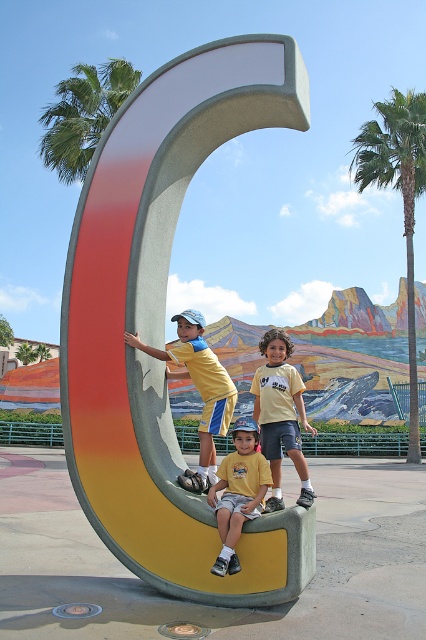
You are a photographer trying to capture a photo of the yellow matte shirt at center and the matte concrete letter c at center. Based on their positions, which object should you focus on first to ensure both are in frame?

The matte concrete letter c at center is above the yellow matte shirt at center, so you should focus on the matte concrete letter c at center first to ensure both are in frame.

You are a photographer trying to capture a photo of the yellow cotton shirt at center without the green leafy palm tree at upper left blocking it. Can you adjust your position to achieve this?

The green leafy palm tree at upper left might be wider than yellow cotton shirt at center, so adjusting your position might help avoid the palm tree blocking the shirt.

From the picture: You are standing in front of the large letter C sculpture with the three children. There are two points marked on the sculpture. One is at coordinate point (414, 358) and the other is at point (278, 356). Which point is closer to you?

Point (414, 358) is further to the viewer than point (278, 356), so the closer point to you is point (278, 356).